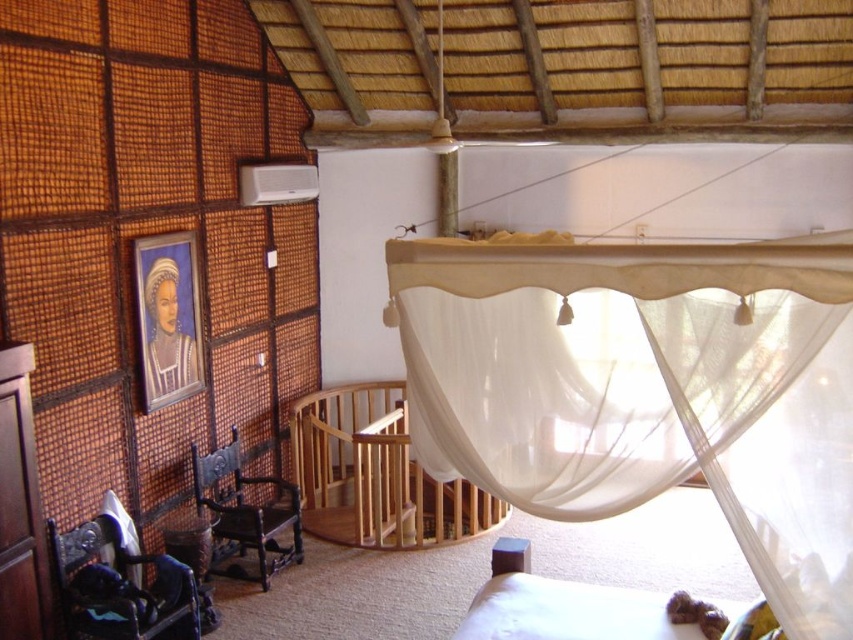
You are a visitor in this traditional African interior and need to choose seating for a guest who prefers a smaller, more compact chair. Which object between the wooden crib at center and the metallic blue chair at lower left would you recommend?

The metallic blue chair at lower left is smaller in size compared to the wooden crib at center, so it would be the more compact option for seating.

You are a parent looking to place a new toy on the floor near the wooden crib at center and the metallic blue chair at lower left. Which object should you place the toy closer to if you want it to be under the crib?

You should place the toy closer to the wooden crib at center because it is positioned over the metallic blue chair at lower left, meaning the crib is above the chair. Therefore, placing the toy near the crib would naturally be under it.

You are standing in the middle of the room and want to sit down. The metallic blue chair at lower left is your target. However, there is a white sheer curtain at center in your path. Can you walk straight to the chair without moving the curtain?

The white sheer curtain at center is located above the metallic blue chair at lower left, so you can walk straight to the metallic blue chair at lower left without moving the curtain since the curtain is above it and not blocking the path.